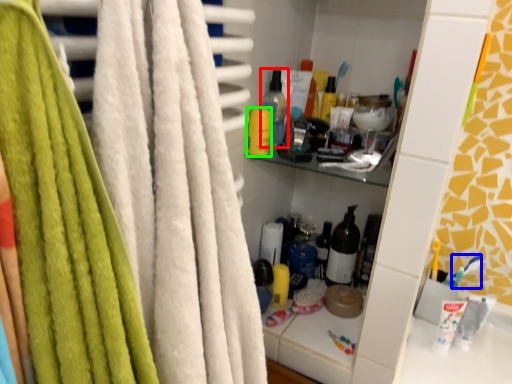
Question: Which is farther away from bottle (highlighted by a red box)? toothbrush (highlighted by a blue box) or toiletry (highlighted by a green box)?

Choices:
 (A) toothbrush
 (B) toiletry

Answer: (A)